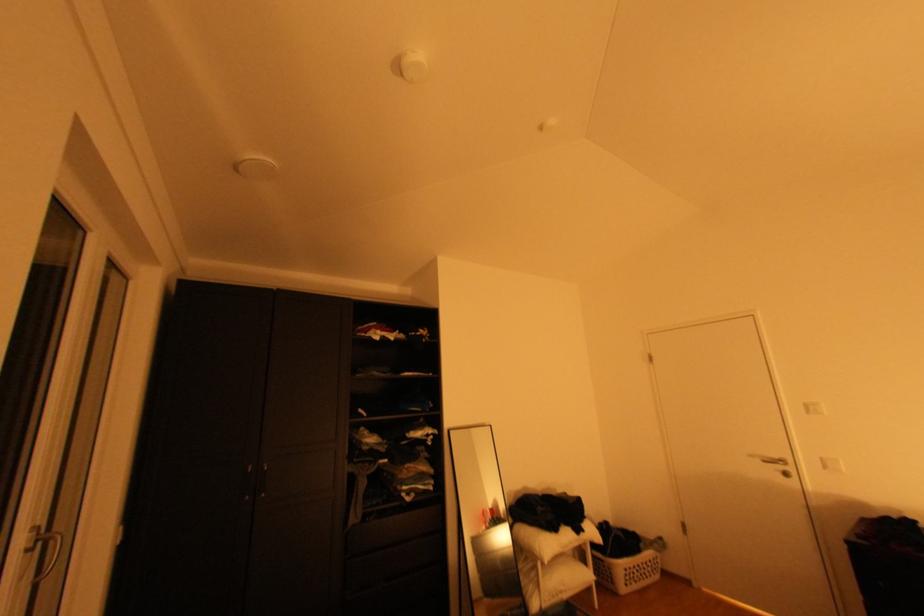
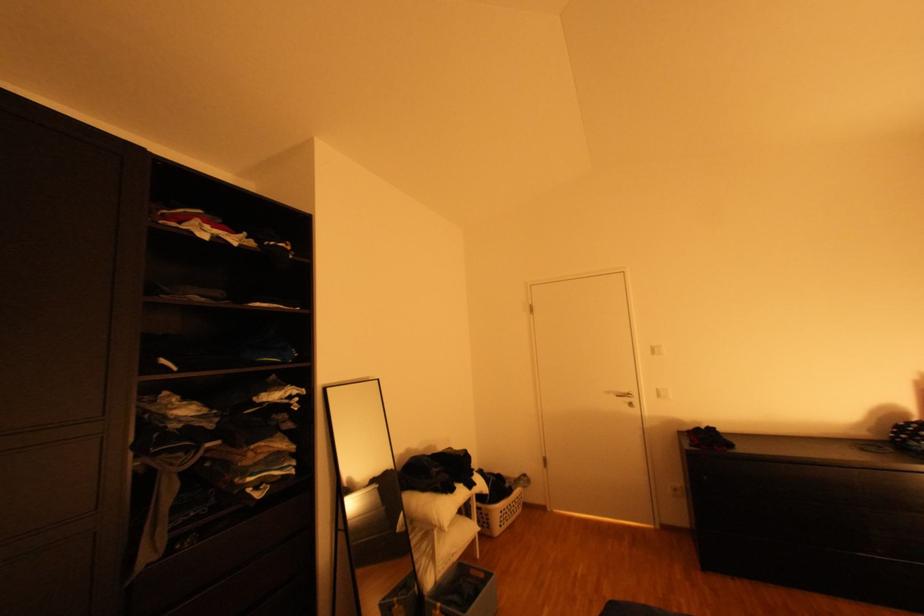
Locate, in the second image, the point that corresponds to point (545, 554) in the first image.

(444, 523)